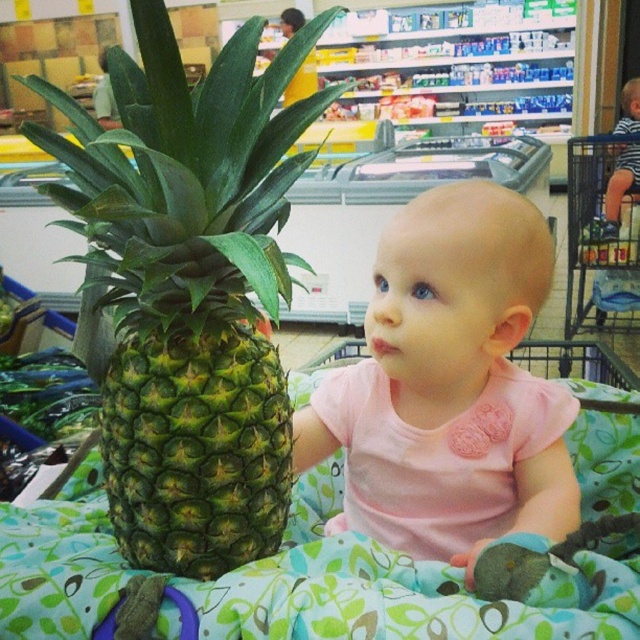
Question: Which point appears closest to the camera in this image?

Choices:
 (A) (202, 486)
 (B) (424, 536)
 (C) (564, 336)

Answer: (A)

Question: Estimate the real-world distances between objects in this image. Which object is closer to the metallic blue shopping cart at upper right?

Choices:
 (A) pink fabric baby at center
 (B) green textured pineapple at center

Answer: (A)

Question: Which point appears farthest from the camera in this image?

Choices:
 (A) (296, 35)
 (B) (481, 224)

Answer: (B)

Question: Is pink fabric baby at center wider than metallic blue shopping cart at upper right?

Choices:
 (A) no
 (B) yes

Answer: (A)

Question: From the image, what is the correct spatial relationship of green textured pineapple at center in relation to metallic blue shopping cart at upper right?

Choices:
 (A) right
 (B) left

Answer: (B)

Question: From the image, what is the correct spatial relationship of green textured pineapple at center in relation to metallic blue shopping cart at upper right?

Choices:
 (A) right
 (B) left

Answer: (B)